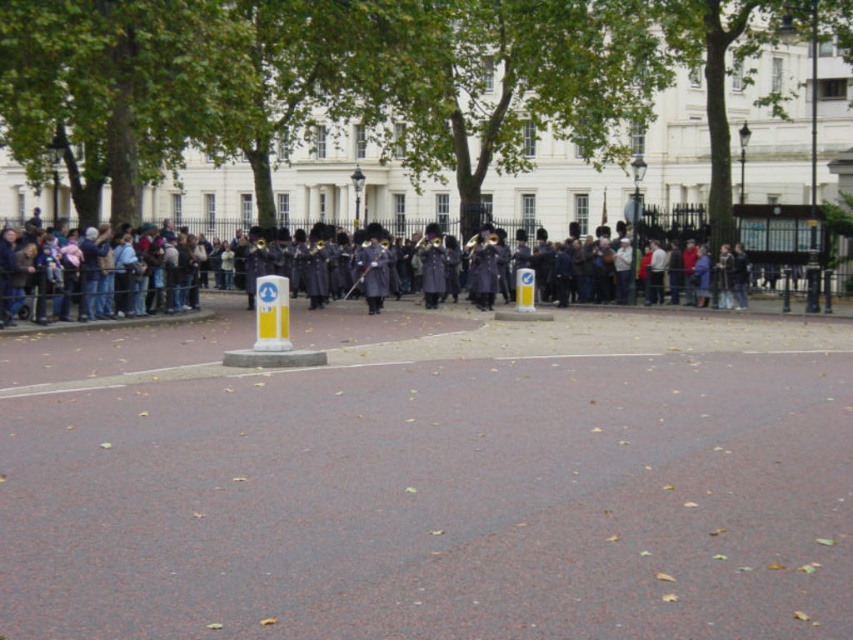
Question: Which object appears closest to the camera in this image?

Choices:
 (A) white glossy building at center
 (B) dark gray uniform at center

Answer: (A)

Question: Can you confirm if white glossy building at center is positioned to the right of dark gray uniform at center?

Choices:
 (A) no
 (B) yes

Answer: (B)

Question: Is white glossy building at center behind dark gray uniform at center?

Choices:
 (A) yes
 (B) no

Answer: (B)

Question: Is white glossy building at center thinner than dark gray uniform at center?

Choices:
 (A) yes
 (B) no

Answer: (B)

Question: Which of the following is the closest to the observer?

Choices:
 (A) dark gray uniform at center
 (B) white glossy building at center

Answer: (B)